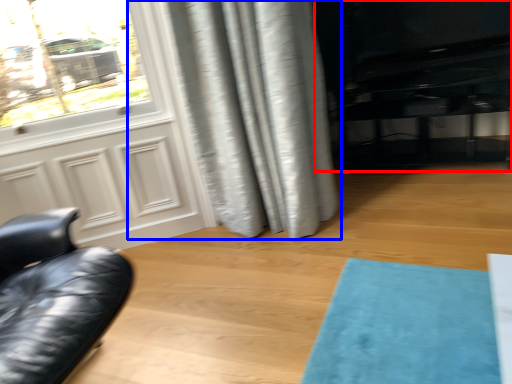
Question: Which object is closer to the camera taking this photo, entertainment center (highlighted by a red box) or curtain (highlighted by a blue box)?

Choices:
 (A) entertainment center
 (B) curtain

Answer: (B)